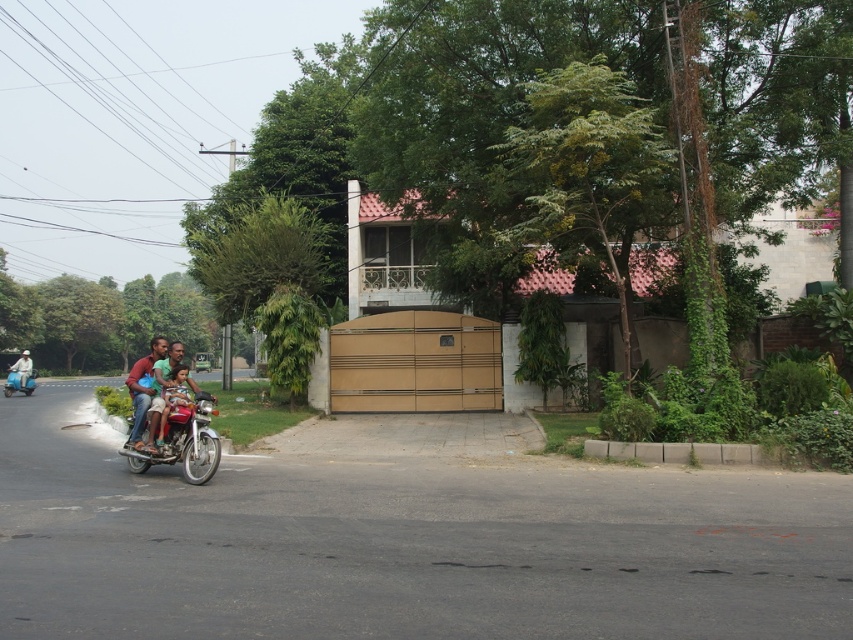
You are a pedestrian standing on the sidewalk next to the road. You see the matte red shirt at left and the blue glossy scooter at left. Which one is closer to you?

The matte red shirt at left is closer to you because it is in front of the blue glossy scooter at left.

You are a delivery person who needs to deliver a package to the house behind the brown gate. The motorbike with three people is blocking the road. The coordinates of the matte red shirt at left are given. Can you estimate whether the motorbike is positioned to the left or right side of the road?

The coordinates of the matte red shirt at left are at point (143, 388), which indicates the motorbike is positioned to the left side of the road.